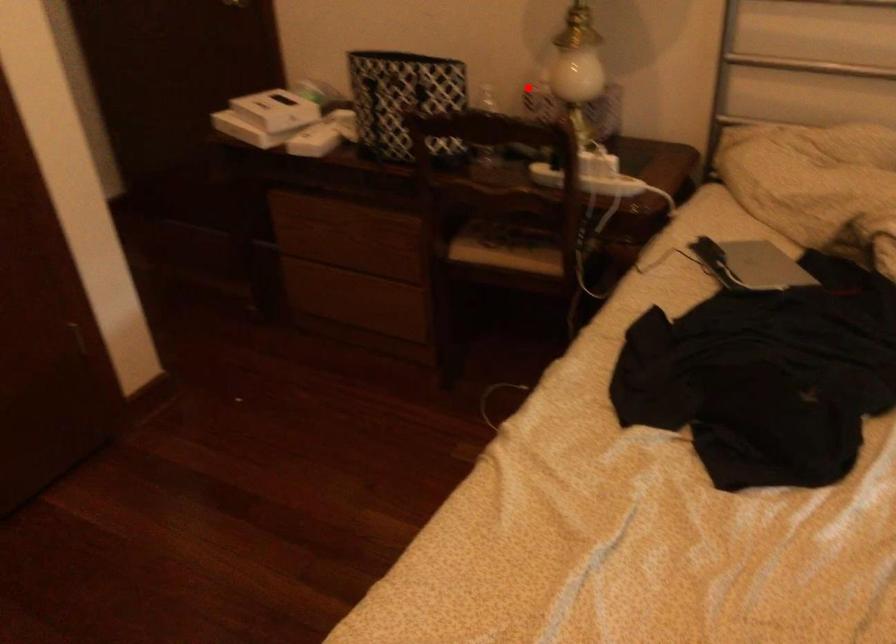
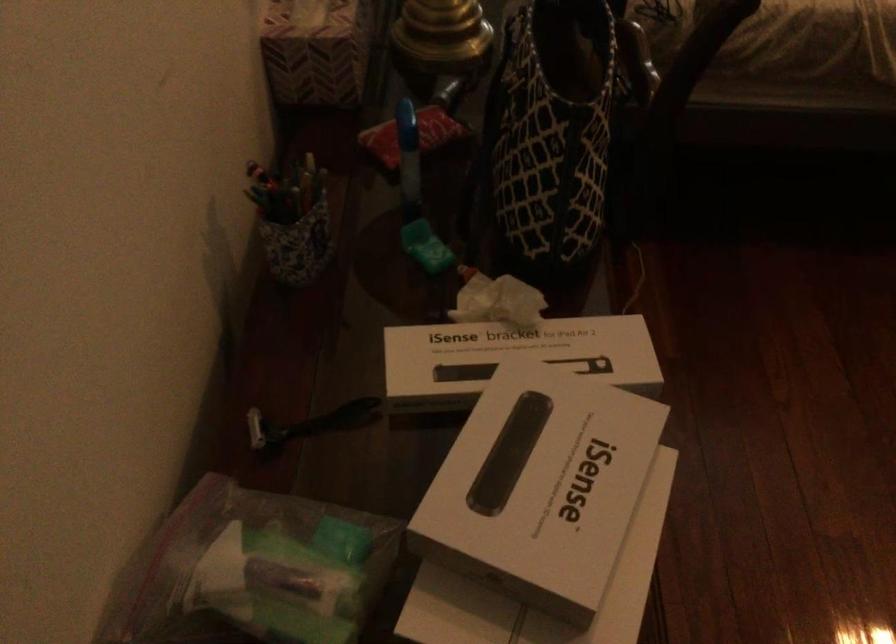
Locate, in the second image, the point that corresponds to the highlighted location in the first image.

(315, 51)